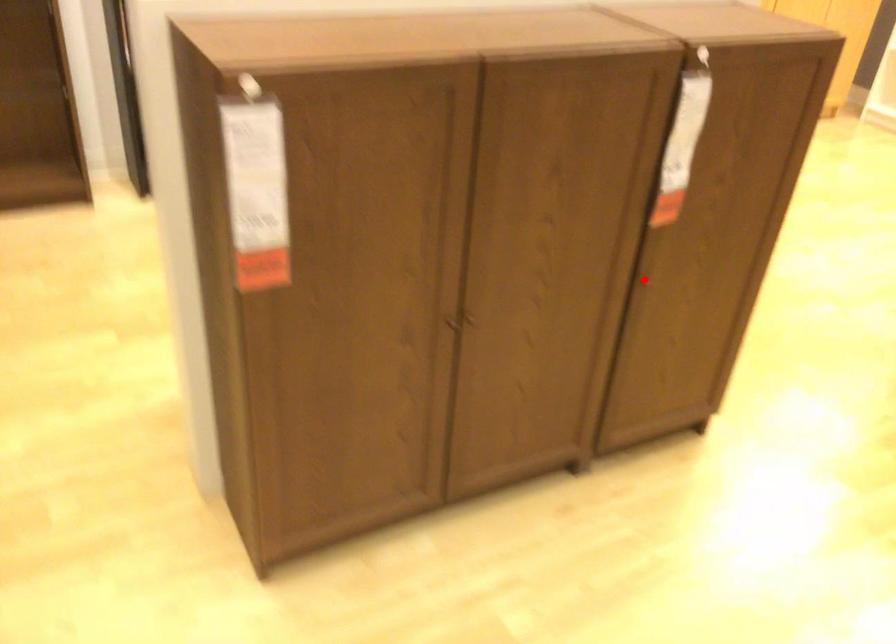
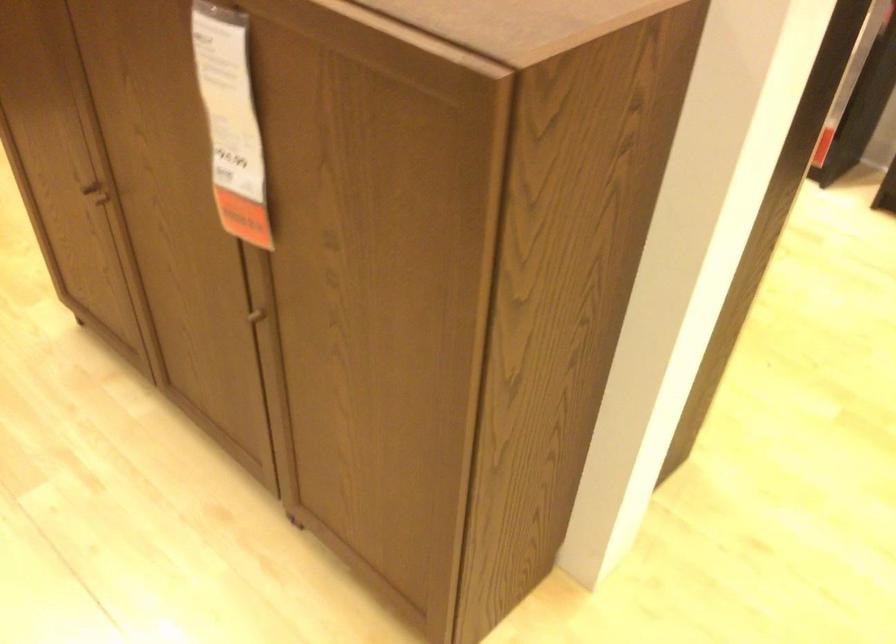
The point at the highlighted location is marked in the first image. Where is the corresponding point in the second image?

(262, 314)